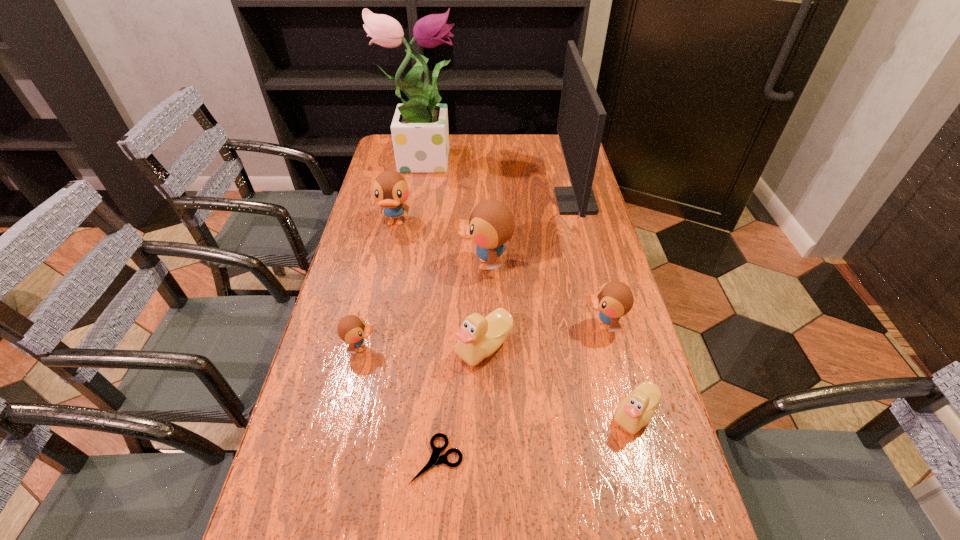
The image size is (960, 540). In the image, there is a desktop. What are the coordinates of `vacant space at the right edge` in the screenshot? It's located at (568, 215).

Locate an element on the screen. free spot between the second smallest blue duck and the sixth shortest object is located at coordinates (499, 274).

Where is `vacant area between the nearest duck and the green flower arrangement`? vacant area between the nearest duck and the green flower arrangement is located at coordinates (529, 286).

Where is `free space between the fifth nearest duck and the second smallest blue duck`? free space between the fifth nearest duck and the second smallest blue duck is located at coordinates (543, 294).

What are the coordinates of `vacant point located between the smallest blue duck and the nearer beige duck` in the screenshot? It's located at (498, 381).

Where is `empty location between the shears and the flower arrangement`? The height and width of the screenshot is (540, 960). empty location between the shears and the flower arrangement is located at coordinates (429, 308).

The height and width of the screenshot is (540, 960). Identify the location of vacant area that lies between the green flower arrangement and the rightmost blue duck. tap(513, 241).

Find the location of a particular element. This screenshot has width=960, height=540. free space between the nearest duck and the second tallest duck is located at coordinates (515, 319).

The width and height of the screenshot is (960, 540). In order to click on vacant space that is in between the farthest duck and the nearest duck in this screenshot , I will do `click(515, 319)`.

Where is `vacant region between the left beige duck and the computer monitor`? This screenshot has height=540, width=960. vacant region between the left beige duck and the computer monitor is located at coordinates (530, 274).